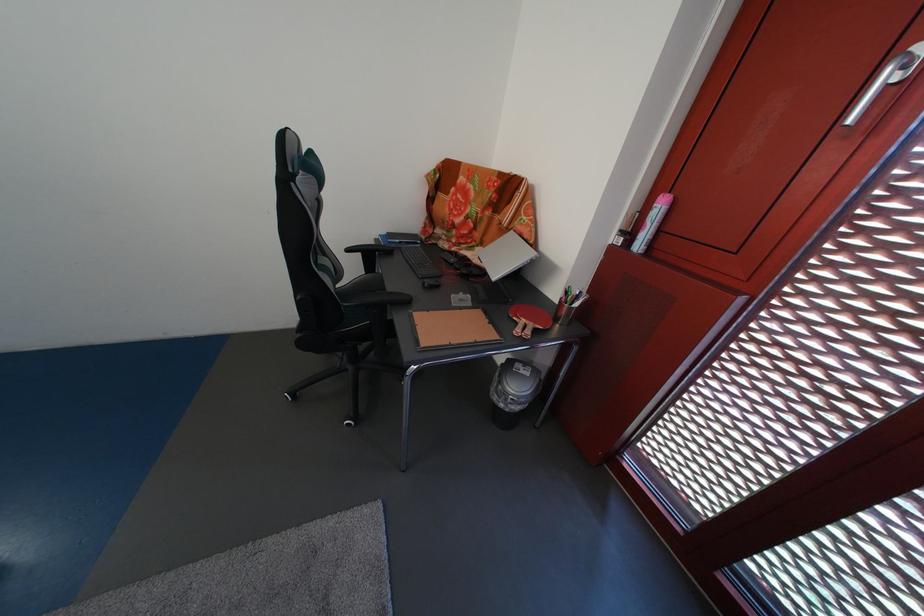
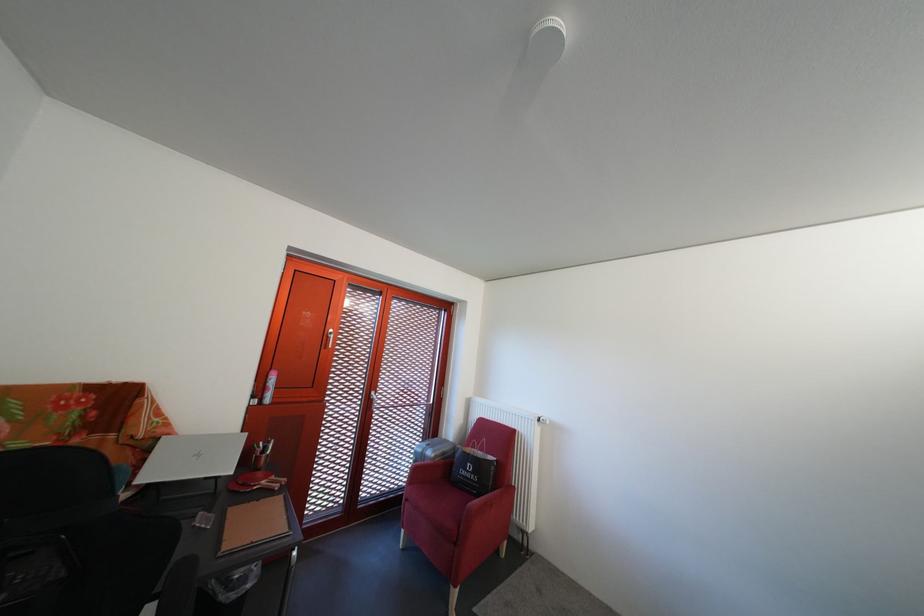
In the second image, find the point that corresponds to point (633, 238) in the first image.

(263, 403)